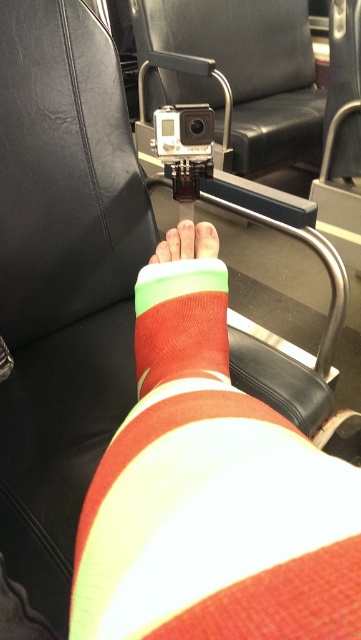
Does matte red cast at center have a lesser width compared to black plastic camera at center?

In fact, matte red cast at center might be wider than black plastic camera at center.

What do you see at coordinates (210, 496) in the screenshot?
I see `matte red cast at center` at bounding box center [210, 496].

Locate an element on the screen. matte red cast at center is located at coordinates (210, 496).

Is black leather chair at upper center above red matte sock at center?

Yes.

Does black leather chair at upper center have a smaller size compared to red matte sock at center?

No.

Is point (196, 35) positioned in front of point (179, 289)?

No, (196, 35) is behind (179, 289).

Identify the location of black leather chair at upper center. This screenshot has height=640, width=361. (248, 70).

Locate an element on the screen. The width and height of the screenshot is (361, 640). black leather chair at upper center is located at coordinates (248, 70).

Is point (248, 19) positioned in front of point (177, 145)?

No, (248, 19) is further to viewer.

Identify the location of black leather chair at upper center. The image size is (361, 640). (248, 70).